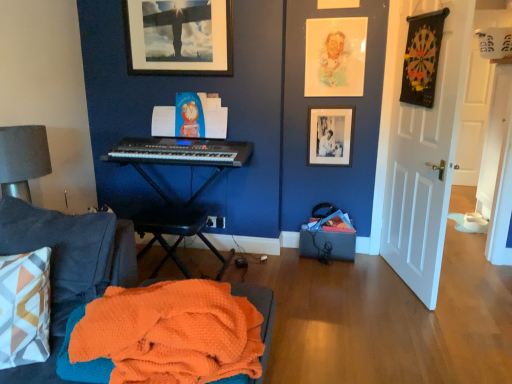
Find the location of `free location in front of white matte door at right`. free location in front of white matte door at right is located at coordinates (419, 321).